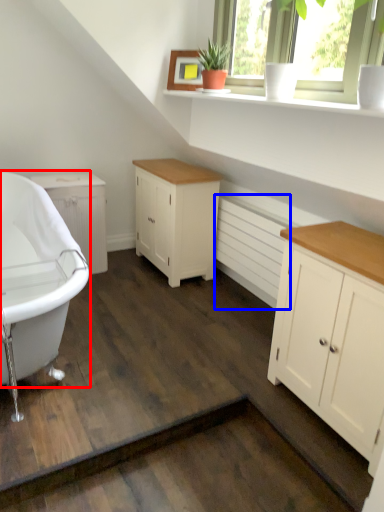
Question: Among these objects, which one is nearest to the camera, bathtub (highlighted by a red box) or radiator (highlighted by a blue box)?

Choices:
 (A) bathtub
 (B) radiator

Answer: (A)